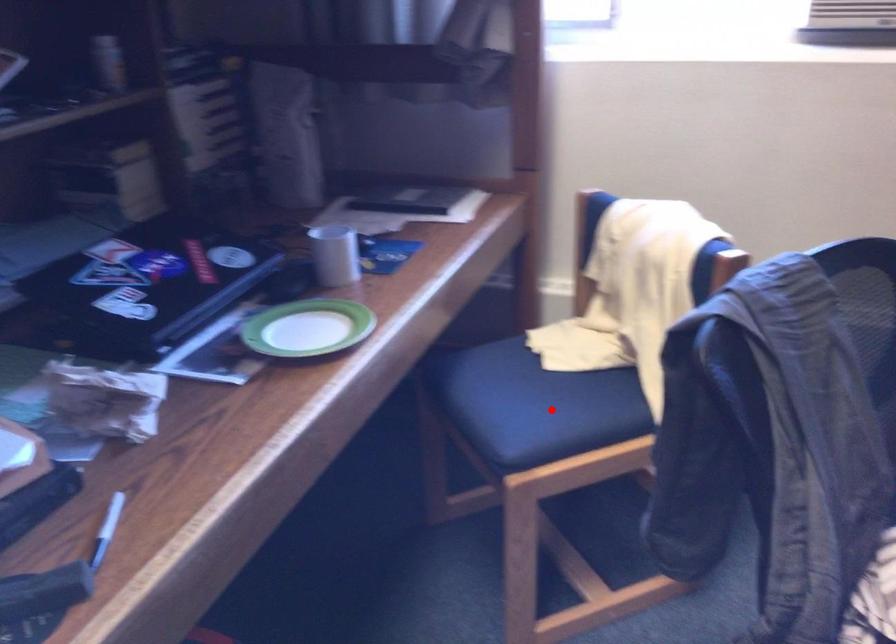
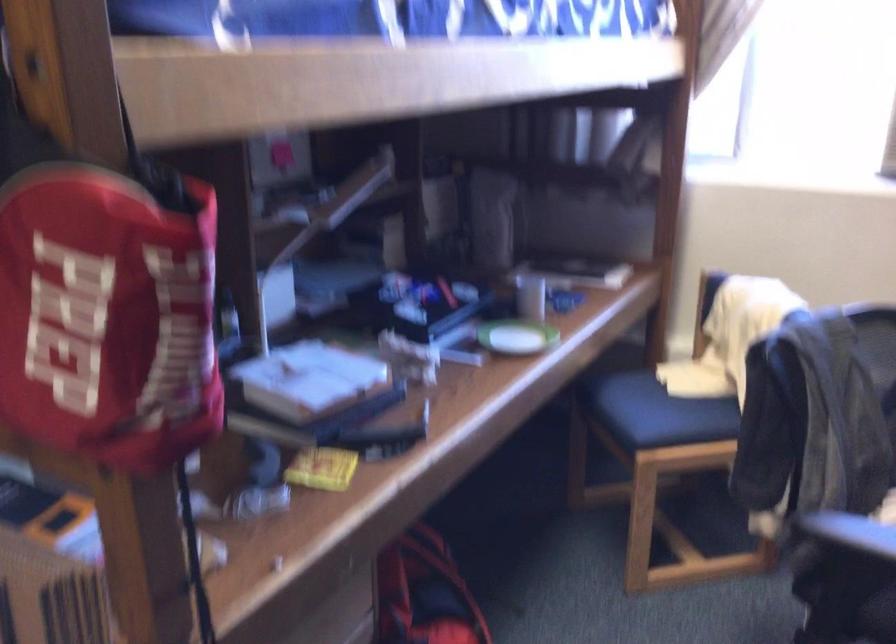
Question: I am providing you with two images of the same scene from different viewpoints. Image1 has a red point marked. In image2, the corresponding 3D location appears at what relative position? Reply with the corresponding letter.

Choices:
 (A) Closer
 (B) Farther

Answer: (B)